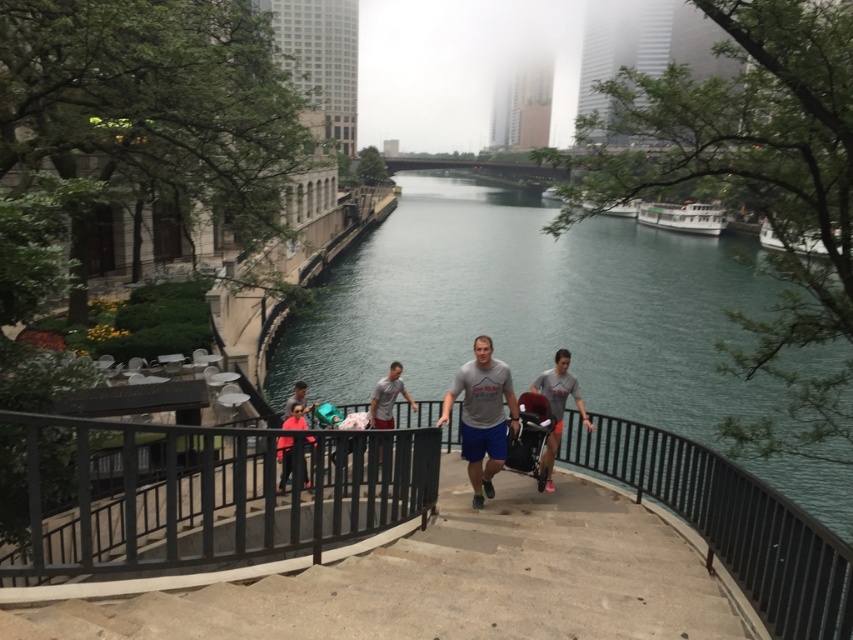
Is concrete stairs at center below white glossy boat at upper right?

Correct, concrete stairs at center is located below white glossy boat at upper right.

Does concrete stairs at center appear on the left side of white glossy boat at upper right?

Yes, concrete stairs at center is to the left of white glossy boat at upper right.

Between point (641, 636) and point (679, 212), which one is positioned behind?

Point (679, 212)

Image resolution: width=853 pixels, height=640 pixels. I want to click on concrete stairs at center, so click(x=434, y=580).

Who is lower down, clear blue water at center or white matte boat at right?

white matte boat at right is below.

Does point (683, 332) come closer to viewer compared to point (811, 243)?

No, it is not.

What do you see at coordinates (532, 307) in the screenshot? Image resolution: width=853 pixels, height=640 pixels. I see `clear blue water at center` at bounding box center [532, 307].

I want to click on clear blue water at center, so click(532, 307).

Is black metal balustrade at center behind gray cotton t-shirt at center?

No, it is not.

This screenshot has width=853, height=640. What do you see at coordinates (196, 492) in the screenshot?
I see `black metal balustrade at center` at bounding box center [196, 492].

The width and height of the screenshot is (853, 640). In order to click on black metal balustrade at center in this screenshot , I will do 196,492.